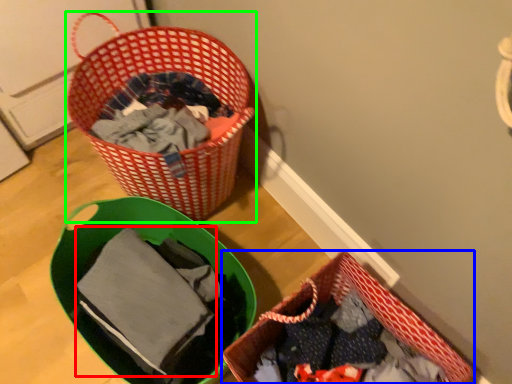
Question: Which object is positioned closest to baby clothe (highlighted by a red box)? Select from picnic basket (highlighted by a blue box) and picnic basket (highlighted by a green box).

Choices:
 (A) picnic basket
 (B) picnic basket

Answer: (A)